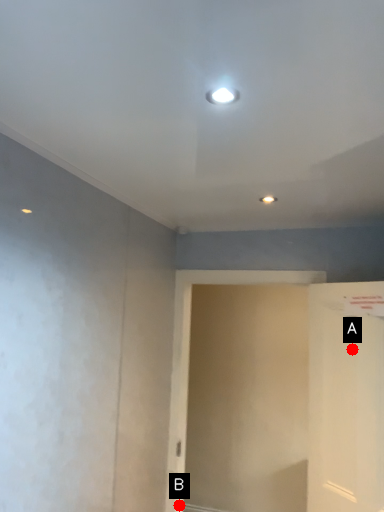
Question: Two points are circled on the image, labeled by A and B beside each circle. Which of the following is the closest to the observer?

Choices:
 (A) A is closer
 (B) B is closer

Answer: (A)